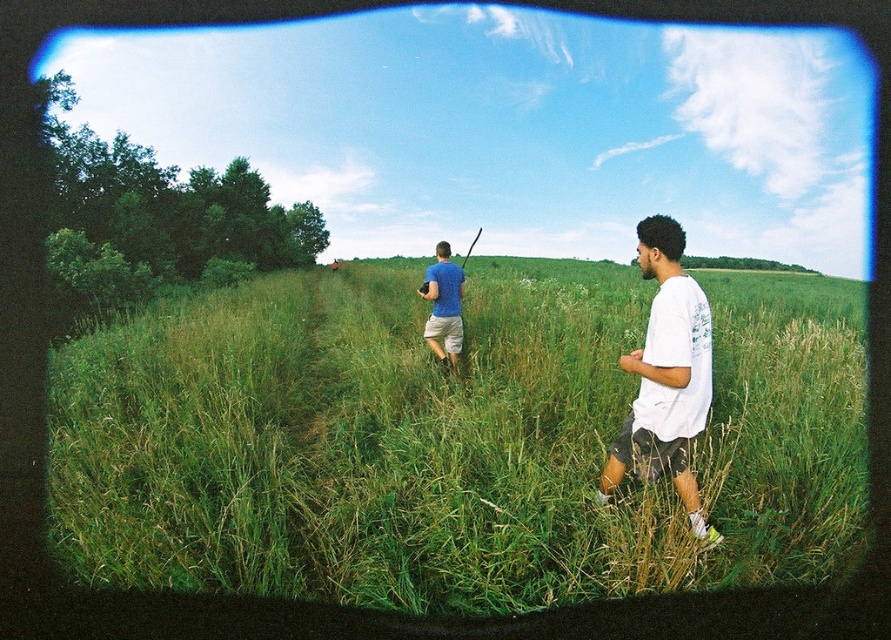
Based on the photo, you are standing in the grassy field and want to place a small picnic blanket. The green grass at center is at coordinates 0.689, 0.506. Can you confirm if this area is suitable for placing the blanket?

The green grass at center is located at point (x=450, y=440), so yes, this area is suitable for placing the picnic blanket as it is the grassy field described in the scene.